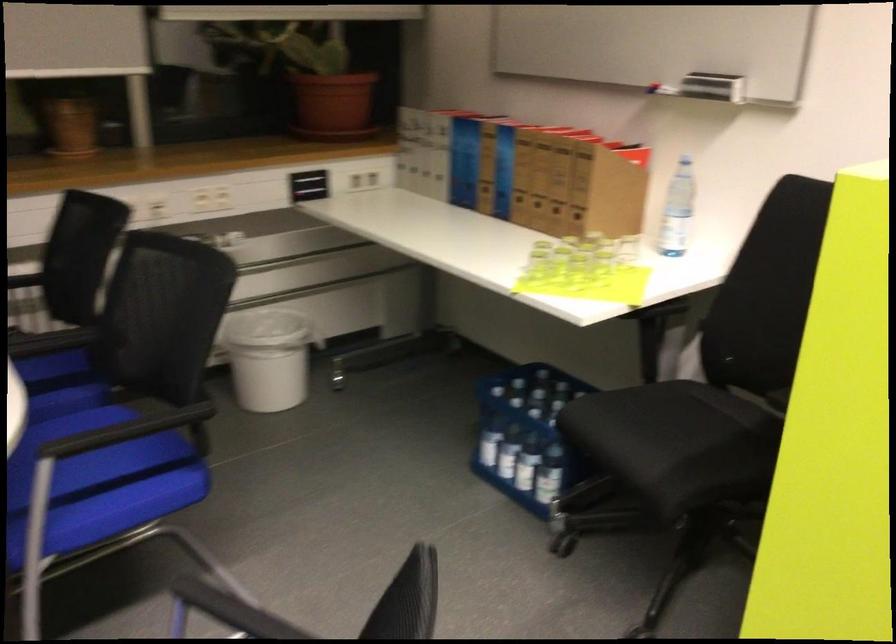
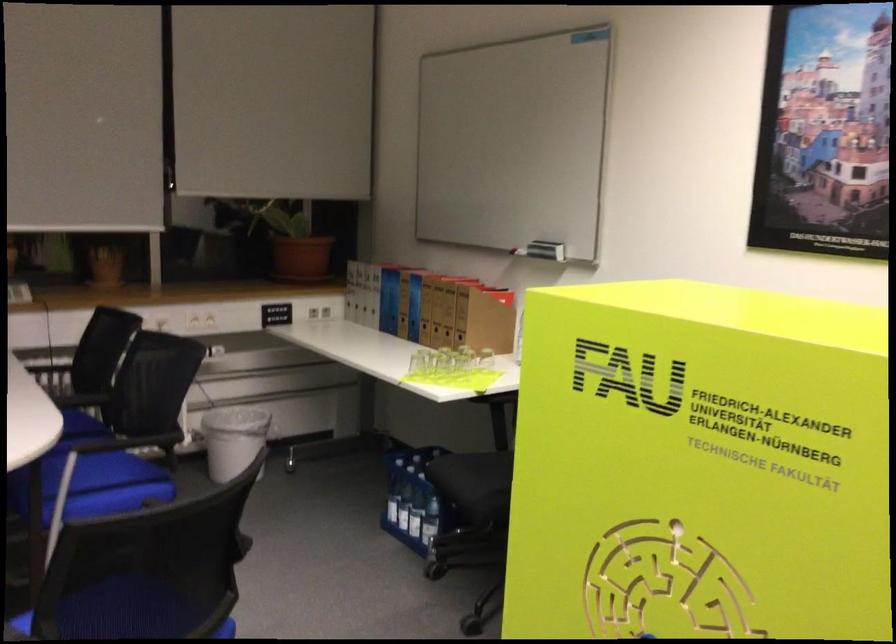
In the second image, find the point that corresponds to pixel 521 455 in the first image.

(416, 514)